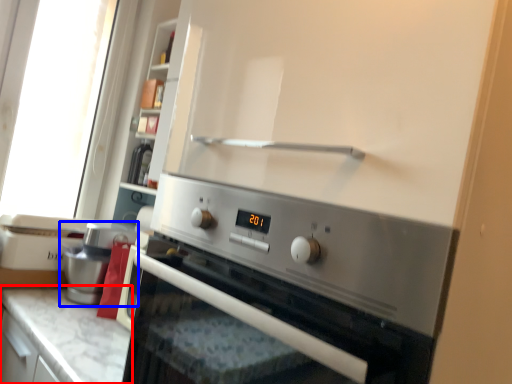
Question: Which object appears closest to the camera in this image, countertop (highlighted by a red box) or coffee machine (highlighted by a blue box)?

Choices:
 (A) countertop
 (B) coffee machine

Answer: (A)